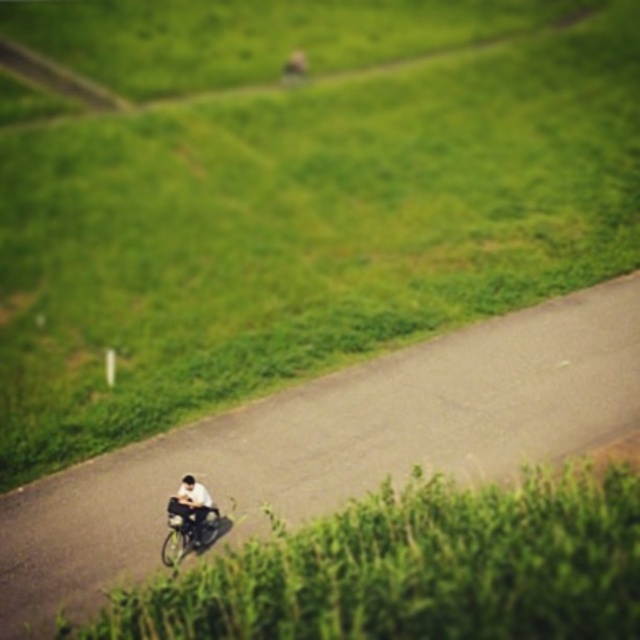
Question: Based on their relative distances, which object is nearer to the white fabric shirt at center?

Choices:
 (A) asphalt road at center
 (B) metallic silver bicycle at center

Answer: (B)

Question: Is asphalt road at center smaller than white fabric shirt at center?

Choices:
 (A) yes
 (B) no

Answer: (B)

Question: Can you confirm if metallic silver bicycle at center is positioned to the left of white fabric shirt at center?

Choices:
 (A) yes
 (B) no

Answer: (A)

Question: Which object is positioned farthest from the white fabric shirt at center?

Choices:
 (A) asphalt road at center
 (B) metallic silver bicycle at center

Answer: (A)

Question: Is metallic silver bicycle at center bigger than white fabric shirt at center?

Choices:
 (A) yes
 (B) no

Answer: (A)

Question: Which object is the farthest from the asphalt road at center?

Choices:
 (A) metallic silver bicycle at center
 (B) white fabric shirt at center

Answer: (B)